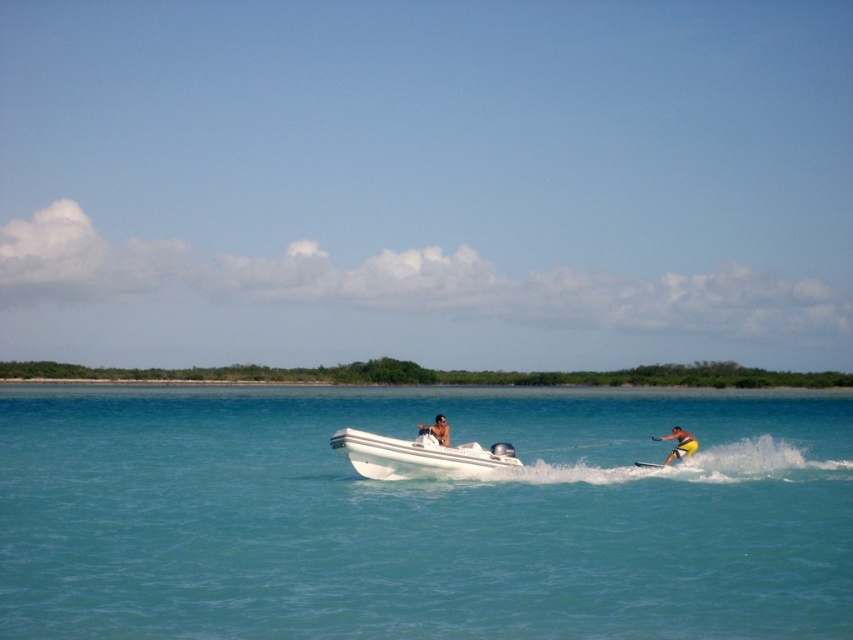
Looking at this image, is white matte boat at center positioned before tan skin human at center?

Yes, it is in front of tan skin human at center.

Between white matte boat at center and tan skin human at center, which one appears on the left side from the viewer's perspective?

white matte boat at center

In order to click on white matte boat at center in this screenshot , I will do `click(419, 456)`.

Where is `white smooth water at center`? The width and height of the screenshot is (853, 640). white smooth water at center is located at coordinates (422, 515).

Find the location of a particular element. white smooth water at center is located at coordinates (422, 515).

Image resolution: width=853 pixels, height=640 pixels. Identify the location of white smooth water at center. (422, 515).

Between point (662, 436) and point (418, 428), which one is positioned in front?

Point (418, 428)

Is point (697, 445) positioned behind point (440, 429)?

That is True.

The height and width of the screenshot is (640, 853). Identify the location of yellow fabric surfboard at lower right. 680,444.